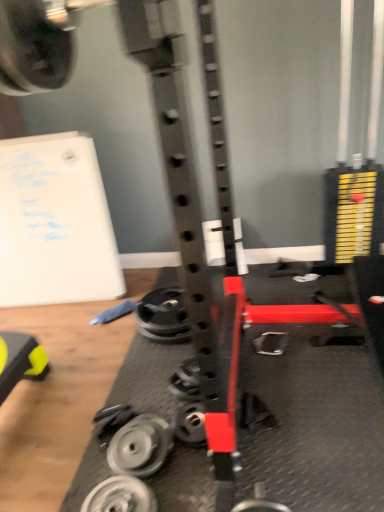
The image size is (384, 512). What do you see at coordinates (120, 496) in the screenshot?
I see `silver metallic weight at lower center, marked as the first wheel in a front-to-back arrangement` at bounding box center [120, 496].

What do you see at coordinates (163, 315) in the screenshot? This screenshot has width=384, height=512. I see `metallic silver weight at center, arranged as the first wheel when viewed from the back` at bounding box center [163, 315].

The image size is (384, 512). I want to click on metallic silver weight at center, the fourth wheel in the bottom-to-top sequence, so click(163, 315).

Find the location of a particular element. The image size is (384, 512). silver metallic weight at lower center, placed as the 4th wheel when sorted from top to bottom is located at coordinates (120, 496).

From a real-world perspective, which wheel is the 1st one underneath the silver metallic weight at center-left, which is the third wheel in back-to-front order? Please provide its 2D coordinates.

[(190, 424)]

Which is in front, metallic silver wheel at center, which is the 3th wheel from bottom to top, or silver metallic weight at center-left, positioned as the 3th wheel in top-to-bottom order?

silver metallic weight at center-left, positioned as the 3th wheel in top-to-bottom order.

Between metallic silver wheel at center, acting as the third wheel starting from the front, and silver metallic weight at center-left, the 2th wheel from the front, which one has smaller size?

With smaller size is metallic silver wheel at center, acting as the third wheel starting from the front.

Is metallic silver weight at center, arranged as the first wheel when viewed from the back, not inside silver metallic weight at lower center, which is counted as the 4th wheel, starting from the back?

Indeed, metallic silver weight at center, arranged as the first wheel when viewed from the back, is completely outside silver metallic weight at lower center, which is counted as the 4th wheel, starting from the back.

Between metallic silver weight at center, the fourth wheel in the bottom-to-top sequence, and silver metallic weight at lower center, which is the first wheel from bottom to top, which one has smaller width?

silver metallic weight at lower center, which is the first wheel from bottom to top, is thinner.

Is metallic silver weight at center, which appears as the fourth wheel when viewed from the front, directly adjacent to silver metallic weight at lower center, placed as the 4th wheel when sorted from top to bottom?

They are not placed beside each other.

Could you tell me if metallic silver weight at center, which appears as the fourth wheel when viewed from the front, is turned towards silver metallic weight at lower center, which is counted as the 4th wheel, starting from the back?

Yes, metallic silver weight at center, which appears as the fourth wheel when viewed from the front, faces towards silver metallic weight at lower center, which is counted as the 4th wheel, starting from the back.

Does silver metallic weight at lower center, placed as the 4th wheel when sorted from top to bottom, have a greater height compared to metallic silver wheel at center, which is the 3th wheel from bottom to top?

No, silver metallic weight at lower center, placed as the 4th wheel when sorted from top to bottom, is not taller than metallic silver wheel at center, which is the 3th wheel from bottom to top.

From the picture: Can you tell me how much silver metallic weight at lower center, placed as the 4th wheel when sorted from top to bottom, and metallic silver wheel at center, which is the 3th wheel from bottom to top, differ in facing direction?

silver metallic weight at lower center, placed as the 4th wheel when sorted from top to bottom, and metallic silver wheel at center, which is the 3th wheel from bottom to top, are facing 4.07 degrees away from each other.

Can we say silver metallic weight at lower center, which is counted as the 4th wheel, starting from the back, lies outside metallic silver wheel at center, marked as the second wheel in a top-to-bottom arrangement?

Yes, silver metallic weight at lower center, which is counted as the 4th wheel, starting from the back, is outside of metallic silver wheel at center, marked as the second wheel in a top-to-bottom arrangement.

From the picture: Is silver metallic weight at lower center, marked as the first wheel in a front-to-back arrangement, beside metallic silver wheel at center, acting as the third wheel starting from the front?

No, silver metallic weight at lower center, marked as the first wheel in a front-to-back arrangement, is not making contact with metallic silver wheel at center, acting as the third wheel starting from the front.

Who is more distant, silver metallic weight at lower center, marked as the first wheel in a front-to-back arrangement, or metallic silver weight at center, the fourth wheel in the bottom-to-top sequence?

Positioned behind is metallic silver weight at center, the fourth wheel in the bottom-to-top sequence.

From a real-world perspective, is silver metallic weight at lower center, which is the first wheel from bottom to top, located higher than metallic silver weight at center, the fourth wheel in the bottom-to-top sequence?

Indeed, from a real-world perspective, silver metallic weight at lower center, which is the first wheel from bottom to top, stands above metallic silver weight at center, the fourth wheel in the bottom-to-top sequence.

Is silver metallic weight at lower center, which is the first wheel from bottom to top, facing towards metallic silver weight at center, which appears as the fourth wheel when viewed from the front?

No, silver metallic weight at lower center, which is the first wheel from bottom to top, is not facing towards metallic silver weight at center, which appears as the fourth wheel when viewed from the front.

Is silver metallic weight at lower center, which is counted as the 4th wheel, starting from the back, at the back of metallic silver wheel at center, marked as the second wheel in a top-to-bottom arrangement?

No, metallic silver wheel at center, marked as the second wheel in a top-to-bottom arrangement, is not facing the opposite direction of silver metallic weight at lower center, which is counted as the 4th wheel, starting from the back.

From a real-world perspective, is metallic silver wheel at center, placed as the second wheel when sorted from back to front, beneath silver metallic weight at lower center, marked as the first wheel in a front-to-back arrangement?

Yes, from a real-world perspective, metallic silver wheel at center, placed as the second wheel when sorted from back to front, is beneath silver metallic weight at lower center, marked as the first wheel in a front-to-back arrangement.

Is point (201, 412) positioned before point (144, 509)?

No, it is behind (144, 509).

Is the surface of metallic silver weight at center, arranged as the first wheel when viewed from the back, in direct contact with silver metallic weight at center-left, which is the third wheel in back-to-front order?

metallic silver weight at center, arranged as the first wheel when viewed from the back, and silver metallic weight at center-left, which is the third wheel in back-to-front order, are clearly separated.

Based on the photo, from the image's perspective, between metallic silver weight at center, the 1th wheel positioned from the top, and silver metallic weight at center-left, which is the second wheel from bottom to top, who is located below?

From the image's view, silver metallic weight at center-left, which is the second wheel from bottom to top, is below.

Based on their sizes in the image, would you say metallic silver weight at center, the fourth wheel in the bottom-to-top sequence, is bigger or smaller than silver metallic weight at center-left, the 2th wheel from the front?

Considering their sizes, metallic silver weight at center, the fourth wheel in the bottom-to-top sequence, takes up more space than silver metallic weight at center-left, the 2th wheel from the front.

In the scene shown: Can you tell me how much metallic silver weight at center, the fourth wheel in the bottom-to-top sequence, and metallic silver wheel at center, acting as the third wheel starting from the front, differ in facing direction?

They differ by 3.7 degrees in their facing directions.

From a real-world perspective, is metallic silver weight at center, the 1th wheel positioned from the top, positioned above or below metallic silver wheel at center, acting as the third wheel starting from the front?

In terms of real-world spatial position, metallic silver weight at center, the 1th wheel positioned from the top, is below metallic silver wheel at center, acting as the third wheel starting from the front.

In the scene shown: How far apart are metallic silver weight at center, arranged as the first wheel when viewed from the back, and metallic silver wheel at center, which is the 3th wheel from bottom to top?

metallic silver weight at center, arranged as the first wheel when viewed from the back, is 21.27 inches away from metallic silver wheel at center, which is the 3th wheel from bottom to top.

Does metallic silver weight at center, the 1th wheel positioned from the top, have a smaller size compared to metallic silver wheel at center, which is the 3th wheel from bottom to top?

No, metallic silver weight at center, the 1th wheel positioned from the top, is not smaller than metallic silver wheel at center, which is the 3th wheel from bottom to top.

Where is `the 1st wheel behind when counting from the silver metallic weight at center-left, which is the third wheel in back-to-front order`? This screenshot has width=384, height=512. the 1st wheel behind when counting from the silver metallic weight at center-left, which is the third wheel in back-to-front order is located at coordinates (190, 424).

Find the location of a particular element. the 3rd wheel located beneath the silver metallic weight at lower center, which is the first wheel from bottom to top (from a real-world perspective) is located at coordinates (163, 315).

Estimate the real-world distances between objects in this image. Which object is further from metallic silver wheel at center, which is the 3th wheel from bottom to top, silver metallic weight at center-left, the 2th wheel from the front, or silver metallic weight at lower center, marked as the first wheel in a front-to-back arrangement?

Among the two, silver metallic weight at lower center, marked as the first wheel in a front-to-back arrangement, is located further to metallic silver wheel at center, which is the 3th wheel from bottom to top.

From the image, which object appears to be nearer to metallic silver wheel at center, marked as the second wheel in a top-to-bottom arrangement, silver metallic weight at lower center, which is the first wheel from bottom to top, or silver metallic weight at center-left, the 2th wheel from the front?

silver metallic weight at center-left, the 2th wheel from the front, lies closer to metallic silver wheel at center, marked as the second wheel in a top-to-bottom arrangement, than the other object.

Which object lies nearer to the anchor point metallic silver wheel at center, placed as the second wheel when sorted from back to front, silver metallic weight at lower center, placed as the 4th wheel when sorted from top to bottom, or metallic silver weight at center, arranged as the first wheel when viewed from the back?

silver metallic weight at lower center, placed as the 4th wheel when sorted from top to bottom, is closer to metallic silver wheel at center, placed as the second wheel when sorted from back to front.

Which object lies further to the anchor point silver metallic weight at center-left, positioned as the 3th wheel in top-to-bottom order, silver metallic weight at lower center, marked as the first wheel in a front-to-back arrangement, or metallic silver wheel at center, which is the 3th wheel from bottom to top?

metallic silver wheel at center, which is the 3th wheel from bottom to top, is positioned further to the anchor silver metallic weight at center-left, positioned as the 3th wheel in top-to-bottom order.

From the picture: Based on their spatial positions, is metallic silver weight at center, which appears as the fourth wheel when viewed from the front, or silver metallic weight at lower center, which is counted as the 4th wheel, starting from the back, closer to silver metallic weight at center-left, positioned as the 3th wheel in top-to-bottom order?

silver metallic weight at lower center, which is counted as the 4th wheel, starting from the back, is positioned closer to the anchor silver metallic weight at center-left, positioned as the 3th wheel in top-to-bottom order.

Looking at the image, which one is located further to silver metallic weight at center-left, positioned as the 3th wheel in top-to-bottom order, metallic silver wheel at center, marked as the second wheel in a top-to-bottom arrangement, or metallic silver weight at center, arranged as the first wheel when viewed from the back?

metallic silver weight at center, arranged as the first wheel when viewed from the back, is further to silver metallic weight at center-left, positioned as the 3th wheel in top-to-bottom order.

From the picture: Which object lies nearer to the anchor point metallic silver weight at center, arranged as the first wheel when viewed from the back, silver metallic weight at lower center, which is the first wheel from bottom to top, or metallic silver wheel at center, which is the 3th wheel from bottom to top?

The object closer to metallic silver weight at center, arranged as the first wheel when viewed from the back, is metallic silver wheel at center, which is the 3th wheel from bottom to top.

Looking at the image, which one is located closer to silver metallic weight at center-left, the 2th wheel from the front, metallic silver wheel at center, acting as the third wheel starting from the front, or silver metallic weight at lower center, which is counted as the 4th wheel, starting from the back?

silver metallic weight at lower center, which is counted as the 4th wheel, starting from the back, is closer to silver metallic weight at center-left, the 2th wheel from the front.

Locate an element on the screen. wheel between silver metallic weight at lower center, placed as the 4th wheel when sorted from top to bottom, and metallic silver wheel at center, which is the 3th wheel from bottom to top, along the z-axis is located at coordinates (140, 446).

Find the location of a particular element. This screenshot has height=512, width=384. wheel located between silver metallic weight at center-left, the 2th wheel from the front, and metallic silver weight at center, arranged as the first wheel when viewed from the back, in the depth direction is located at coordinates 190,424.